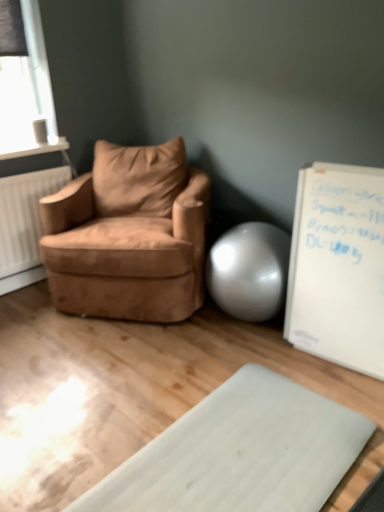
Find the location of a particular element. free space in front of suede brown armchair at left is located at coordinates (135, 387).